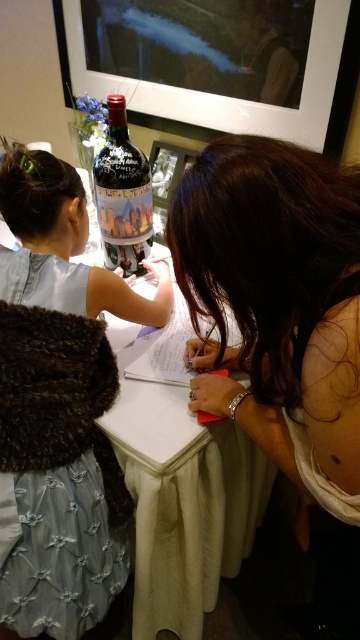
You are a photographer trying to capture a closeup of the brown hair at upper center and the light blue denim dress at lower left. Which object should you focus on first to ensure both are in focus?

The brown hair at upper center is closer to the viewer than the light blue denim dress at lower left, so focus on the brown hair at upper center first to ensure both are in focus.

You are a photographer taking a portrait of the two people in the scene. The light blue denim dress at lower left is blocking the view of the brown hair at upper center. How can you adjust the camera angle to ensure both are visible?

Move the camera to the left so that the light blue denim dress at lower left moves out of the way, allowing the brown hair at upper center to be seen.